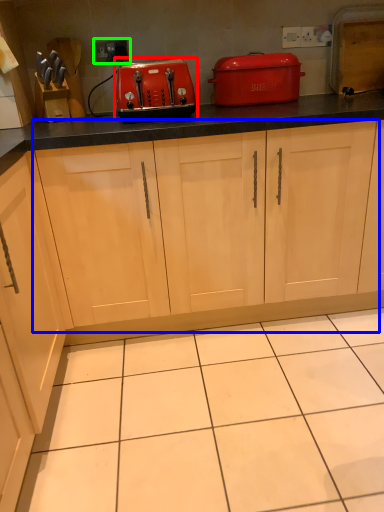
Question: Considering the real-world distances, which object is closest to kitchen appliance (highlighted by a red box)? cabinetry (highlighted by a blue box) or electric outlet (highlighted by a green box).

Choices:
 (A) cabinetry
 (B) electric outlet

Answer: (A)